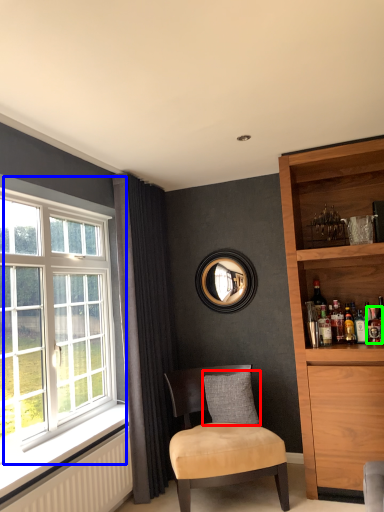
Question: Which object is positioned closest to pillow (highlighted by a red box)? Select from window (highlighted by a blue box) and beverage (highlighted by a green box).

Choices:
 (A) window
 (B) beverage

Answer: (B)